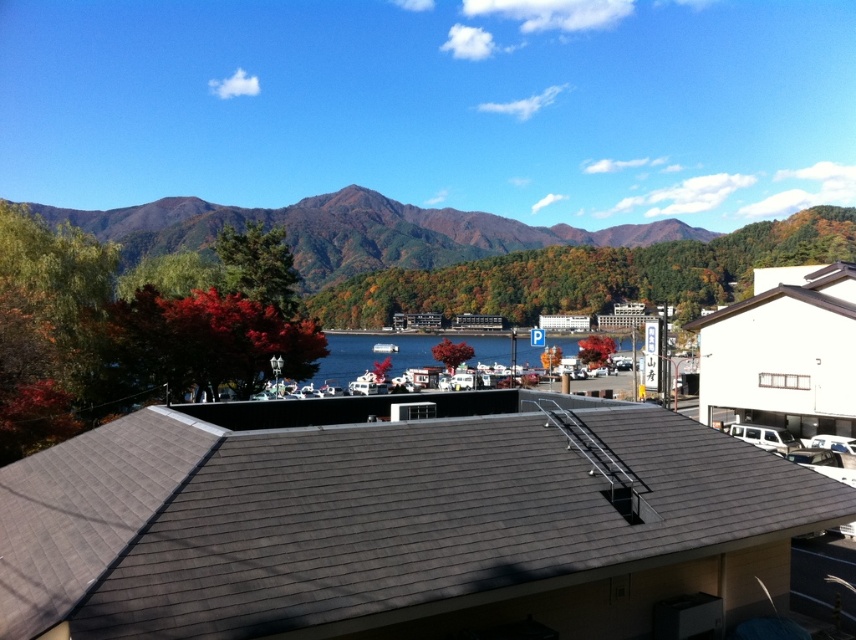
Can you confirm if blue water at center is bigger than white plastic boat at center?

Correct, blue water at center is larger in size than white plastic boat at center.

Is blue water at center smaller than white plastic boat at center?

Actually, blue water at center might be larger than white plastic boat at center.

Between point (361, 336) and point (379, 346), which one is positioned behind?

Positioned behind is point (361, 336).

Find the location of a particular element. The height and width of the screenshot is (640, 856). blue water at center is located at coordinates (372, 355).

Measure the distance between green forested mountain at upper center and white plastic boat at center.

The distance of green forested mountain at upper center from white plastic boat at center is 84.67 meters.

Which is in front, point (195, 240) or point (388, 342)?

Point (388, 342)

Find the location of `green forested mountain at upper center`. green forested mountain at upper center is located at coordinates (474, 256).

Does point (51, 211) lie behind point (348, 368)?

Yes, it is behind point (348, 368).

Can you confirm if green forested mountain at upper center is taller than blue water at center?

Correct, green forested mountain at upper center is much taller as blue water at center.

You are a GUI agent. You are given a task and a screenshot of the screen. Output one action in this format:
    pyautogui.click(x=<x>, y=<y>)
    Task: Click on the green forested mountain at upper center
    The width and height of the screenshot is (856, 640).
    Given the screenshot: What is the action you would take?
    pyautogui.click(x=474, y=256)